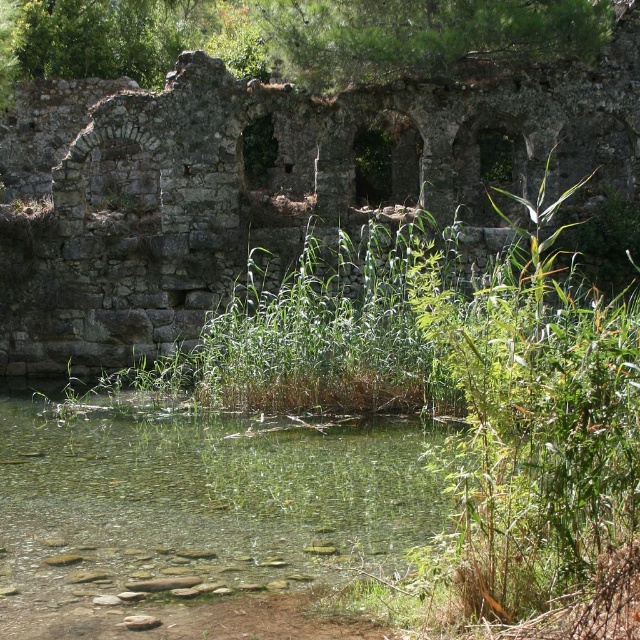
You are standing at the point marked as point (253, 188) in the image. What ancient structure can you see in front of you?

The rusty stone ruins at center is located at point (253, 188), so you can see the rusty stone ruins at center in front of you.

You are standing in front of the ancient stone ruins and want to determine the relative positions of two points marked in the scene. Which point, point [305,564] or point [420,54], is closer to you?

Point [305,564] is closer to the viewer than point [420,54].

You are a hiker who wants to cross from the rusty stone ruins at center to the clear water at center. The bridge you usually use is broken. Can you walk directly between them? Explain why or why not using the distance provided.

The rusty stone ruins at center is 56.52 feet away from clear water at center. Since the distance is quite large, walking directly between them without a bridge may be difficult or unsafe, especially over potentially unstable terrain. It is advisable to find an alternative path or wait for the bridge to be repaired.